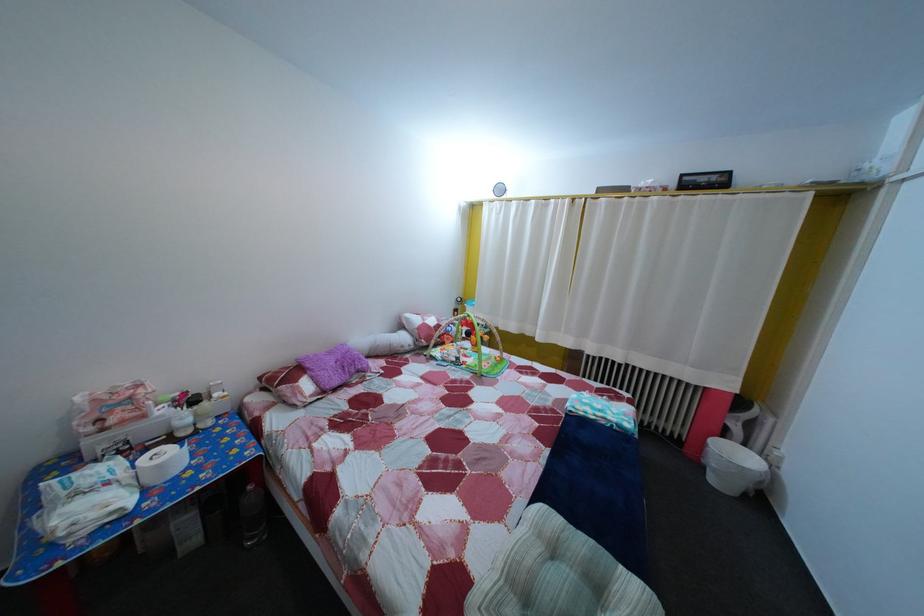
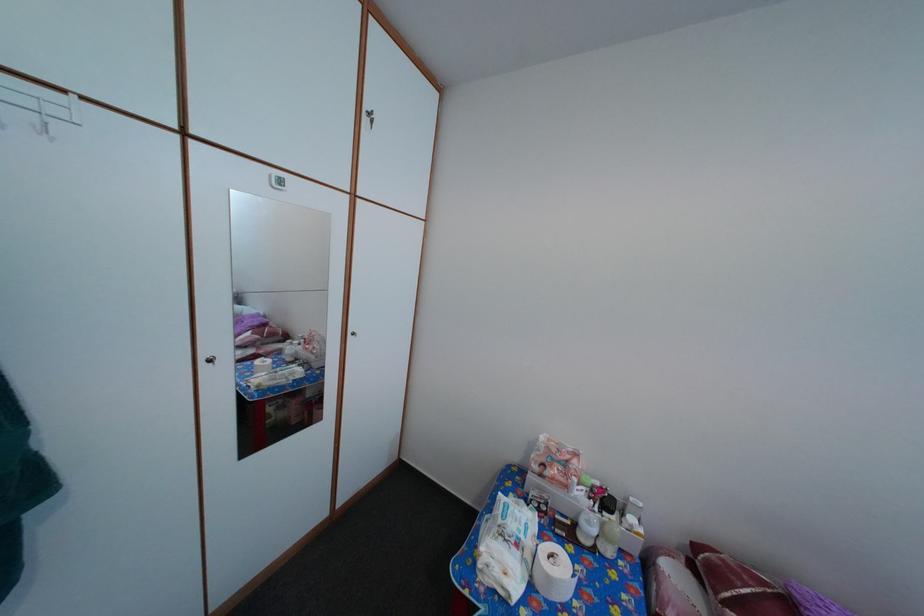
Where in the second image is the point corresponding to (x=62, y=553) from the first image?

(484, 572)